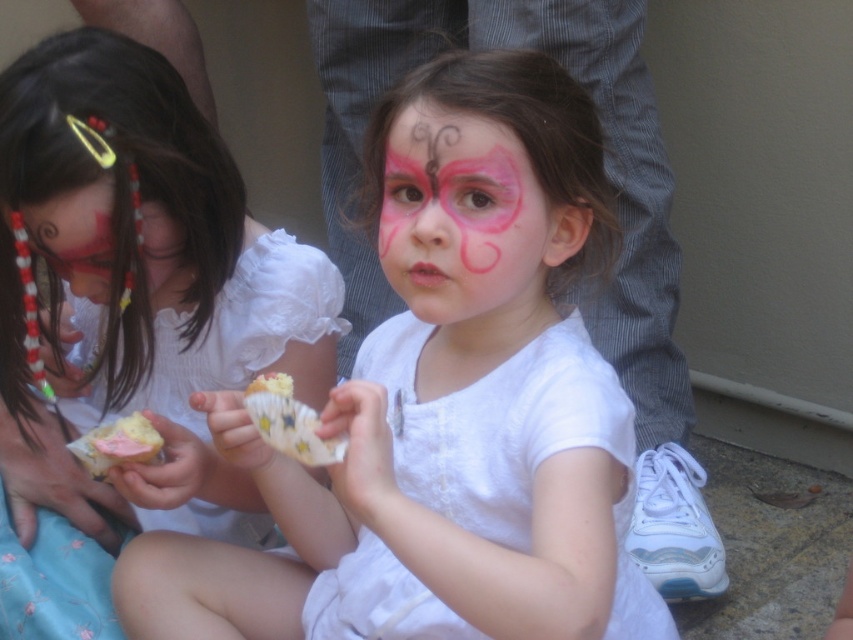
You are a photographer trying to capture the perfect shot of the pink matte butterfly at center. To ensure the butterfly is in the exact center of your photo, you need to adjust your camera. What coordinates should you aim for?

The pink matte butterfly at center is located at coordinates (x=463, y=220), so you should aim your camera at those coordinates to center it.

You are a photographer taking a picture of the two children. You notice the pink matte butterfly at center and the pink paper cupcake at center. Which object should you focus on if you want to capture the one that is positioned to the right of the other?

The pink matte butterfly at center is to the right of the pink paper cupcake at center, so you should focus on the pink matte butterfly at center to capture the one on the right.